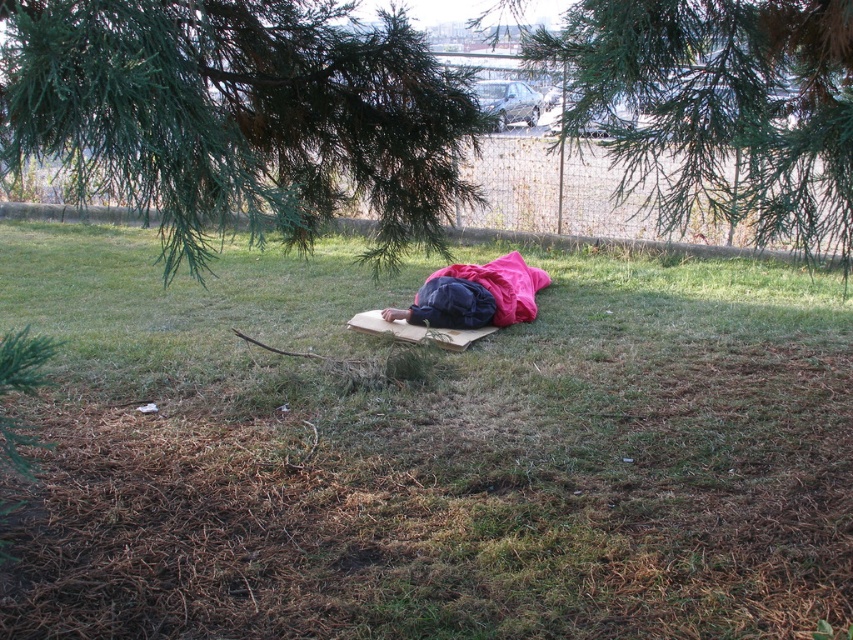
Does green grass at center appear on the left side of dark blue fabric sleeping bag at center?

Correct, you'll find green grass at center to the left of dark blue fabric sleeping bag at center.

Between green grass at center and dark blue fabric sleeping bag at center, which one has less height?

Standing shorter between the two is green grass at center.

Find the location of `green grass at center`. green grass at center is located at coordinates (428, 452).

Does green grass at center have a greater width compared to green needle-like leaves at upper center?

Incorrect, green grass at center's width does not surpass green needle-like leaves at upper center's.

This screenshot has width=853, height=640. What do you see at coordinates (428, 452) in the screenshot?
I see `green grass at center` at bounding box center [428, 452].

Between point (610, 332) and point (436, 221), which one is positioned in front?

Point (436, 221) is in front.

Where is `green grass at center`? The width and height of the screenshot is (853, 640). green grass at center is located at coordinates (428, 452).

Who is lower down, green needle-like leaves at upper center or green leafy tree at center?

Positioned lower is green leafy tree at center.

Describe the element at coordinates (236, 115) in the screenshot. I see `green needle-like leaves at upper center` at that location.

Where is `green needle-like leaves at upper center`? green needle-like leaves at upper center is located at coordinates (236, 115).